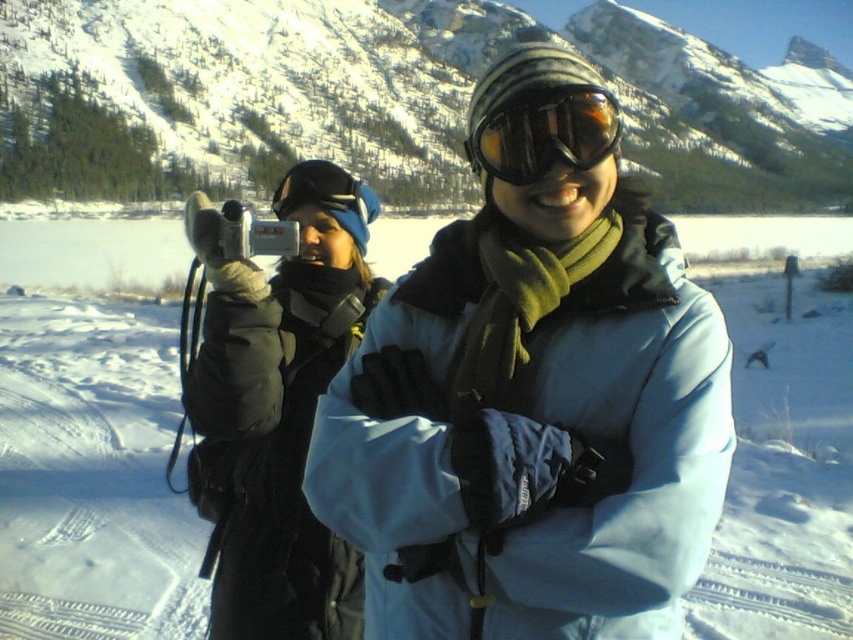
Can you confirm if matte gray jacket at center is bigger than matte black goggles at center?

Indeed, matte gray jacket at center has a larger size compared to matte black goggles at center.

This screenshot has height=640, width=853. I want to click on matte gray jacket at center, so click(x=277, y=408).

Describe the element at coordinates (277, 408) in the screenshot. Image resolution: width=853 pixels, height=640 pixels. I see `matte gray jacket at center` at that location.

Find the location of a particular element. This screenshot has width=853, height=640. matte gray jacket at center is located at coordinates (277, 408).

Can you confirm if snowy mountain at upper center is positioned to the left of matte black goggles at center?

Incorrect, snowy mountain at upper center is not on the left side of matte black goggles at center.

Which is more to the left, snowy mountain at upper center or matte black goggles at center?

From the viewer's perspective, matte black goggles at center appears more on the left side.

This screenshot has height=640, width=853. Identify the location of snowy mountain at upper center. (387, 99).

The height and width of the screenshot is (640, 853). I want to click on snowy mountain at upper center, so click(x=387, y=99).

Can you confirm if blue matte jacket at center is positioned to the left of snowy mountain at upper center?

Correct, you'll find blue matte jacket at center to the left of snowy mountain at upper center.

Based on the photo, is blue matte jacket at center positioned at the back of snowy mountain at upper center?

No.

Measure the distance between point (444, 269) and camera.

They are 42.85 meters apart.

You are a GUI agent. You are given a task and a screenshot of the screen. Output one action in this format:
    pyautogui.click(x=<x>, y=<y>)
    Task: Click on the blue matte jacket at center
    
    Given the screenshot: What is the action you would take?
    pyautogui.click(x=532, y=422)